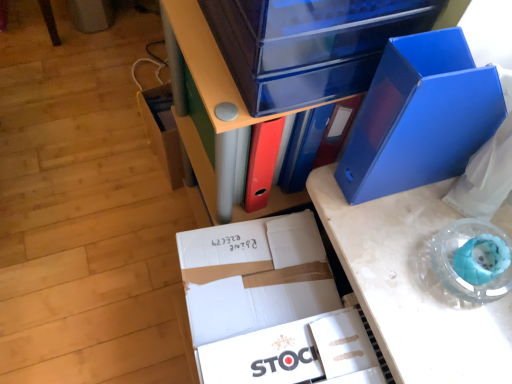
Identify the location of vacant area that lies in front of matte plastic storage box at lower left, the 2th storage box positioned from the front. The image size is (512, 384). (153, 210).